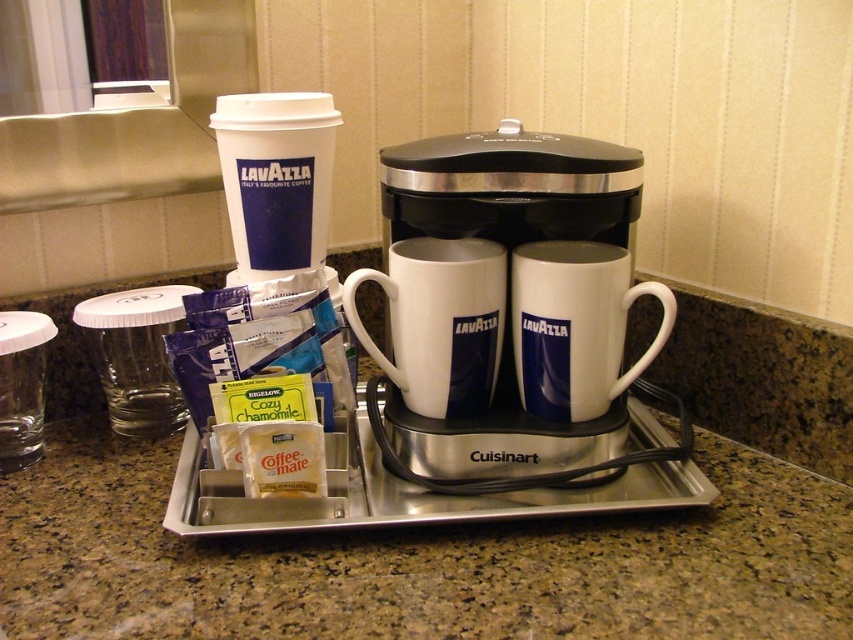
Question: Can you confirm if granite countertop at center is smaller than white glossy mug at center?

Choices:
 (A) yes
 (B) no

Answer: (B)

Question: Which point is closer to the camera?

Choices:
 (A) white ceramic mug at center
 (B) white glossy mug at center
 (C) granite countertop at center

Answer: (C)

Question: Which point is farther to the camera?

Choices:
 (A) (561, 342)
 (B) (494, 380)

Answer: (B)

Question: Estimate the real-world distances between objects in this image. Which object is closer to the granite countertop at center?

Choices:
 (A) white glossy ceramic coffee machine at center
 (B) white glossy mug at center

Answer: (A)

Question: Does white glossy ceramic coffee machine at center have a greater width compared to white glossy mug at center?

Choices:
 (A) yes
 (B) no

Answer: (A)

Question: Is white ceramic mug at center thinner than white glossy mug at center?

Choices:
 (A) no
 (B) yes

Answer: (B)